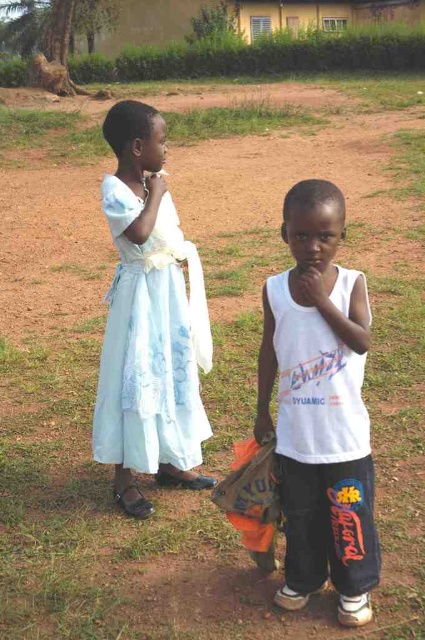
Which is in front, point (306, 445) or point (105, 461)?

Point (306, 445) is more forward.

At what (x,y) coordinates should I click in order to perform the action: click on white cotton tank top at center. Please return your answer as a coordinate pair (x, y). This screenshot has width=425, height=640. Looking at the image, I should click on (320, 406).

At what (x,y) coordinates should I click in order to perform the action: click on white cotton tank top at center. Please return your answer as a coordinate pair (x, y). Looking at the image, I should click on (320, 406).